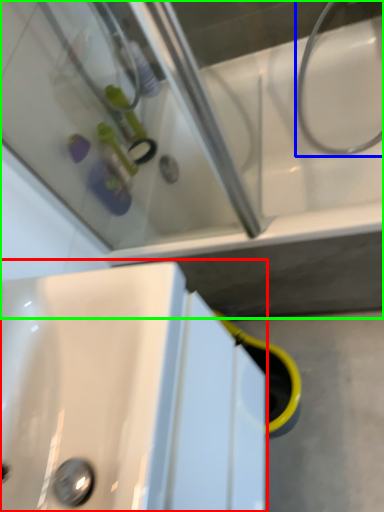
Question: Which object is positioned closest to sink (highlighted by a red box)? Select from plumbing fixture (highlighted by a blue box) and bath (highlighted by a green box).

Choices:
 (A) plumbing fixture
 (B) bath

Answer: (B)